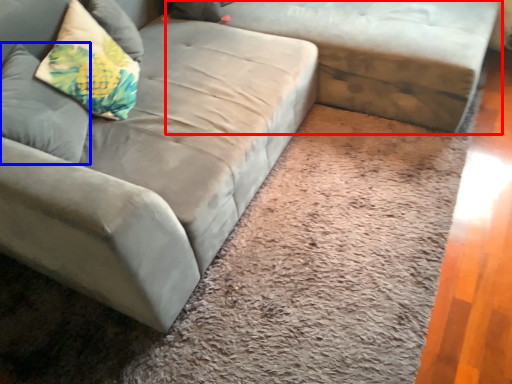
Question: Among these objects, which one is nearest to the camera, studio couch (highlighted by a red box) or pillow (highlighted by a blue box)?

Choices:
 (A) studio couch
 (B) pillow

Answer: (B)